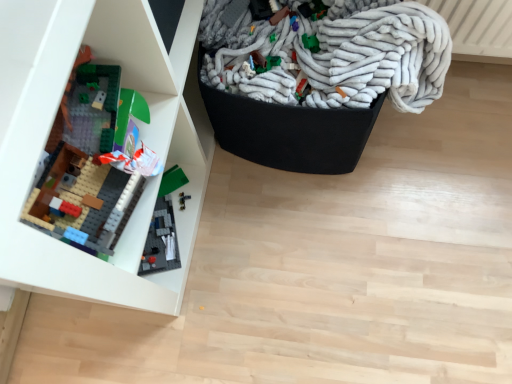
This screenshot has width=512, height=384. What do you see at coordinates (138, 125) in the screenshot? I see `matte plastic lego set at left` at bounding box center [138, 125].

This screenshot has width=512, height=384. Find the location of `matte plastic lego set at left`. matte plastic lego set at left is located at coordinates (138, 125).

What are the coordinates of `white fuzzy blanket at upper right` in the screenshot? It's located at (334, 57).

The width and height of the screenshot is (512, 384). What do you see at coordinates (334, 57) in the screenshot? I see `white fuzzy blanket at upper right` at bounding box center [334, 57].

The image size is (512, 384). I want to click on matte plastic lego set at left, so click(138, 125).

Based on the photo, which object is positioned more to the left, white fuzzy blanket at upper right or matte plastic lego set at left?

matte plastic lego set at left.

Is white fuzzy blanket at upper right closer to camera compared to matte plastic lego set at left?

No.

Is point (212, 65) closer or farther from the camera than point (195, 221)?

Point (212, 65) is positioned closer to the camera compared to point (195, 221).

From the image's perspective, is white fuzzy blanket at upper right beneath matte plastic lego set at left?

No, from the image's perspective, white fuzzy blanket at upper right is not below matte plastic lego set at left.

From a real-world perspective, between white fuzzy blanket at upper right and matte plastic lego set at left, who is vertically lower?

white fuzzy blanket at upper right, from a real-world perspective.

Considering the sizes of objects white fuzzy blanket at upper right and matte plastic lego set at left in the image provided, who is wider, white fuzzy blanket at upper right or matte plastic lego set at left?

white fuzzy blanket at upper right is wider.

Does white fuzzy blanket at upper right have a lesser height compared to matte plastic lego set at left?

Correct, white fuzzy blanket at upper right is not as tall as matte plastic lego set at left.

Looking at this image, does white fuzzy blanket at upper right have a larger size compared to matte plastic lego set at left?

Actually, white fuzzy blanket at upper right might be smaller than matte plastic lego set at left.

Can we say white fuzzy blanket at upper right lies outside matte plastic lego set at left?

Indeed, white fuzzy blanket at upper right is completely outside matte plastic lego set at left.

Is white fuzzy blanket at upper right in contact with matte plastic lego set at left?

white fuzzy blanket at upper right and matte plastic lego set at left are not in contact.

Is white fuzzy blanket at upper right looking in the opposite direction of matte plastic lego set at left?

Yes, white fuzzy blanket at upper right's orientation is away from matte plastic lego set at left.

What's the angular difference between white fuzzy blanket at upper right and matte plastic lego set at left's facing directions?

white fuzzy blanket at upper right and matte plastic lego set at left are facing 1.88e-05 degrees away from each other.

Locate an element on the screen. The width and height of the screenshot is (512, 384). wrap behind the matte plastic lego set at left is located at coordinates (334, 57).

Considering the positions of objects matte plastic lego set at left and white fuzzy blanket at upper right in the image provided, who is more to the left, matte plastic lego set at left or white fuzzy blanket at upper right?

From the viewer's perspective, matte plastic lego set at left appears more on the left side.

Does matte plastic lego set at left come behind white fuzzy blanket at upper right?

No.

Is point (20, 132) positioned before point (264, 32)?

Yes, it is.

From the image's perspective, is matte plastic lego set at left above or below white fuzzy blanket at upper right?

matte plastic lego set at left is situated lower than white fuzzy blanket at upper right in the image.

From a real-world perspective, is matte plastic lego set at left under white fuzzy blanket at upper right?

No, from a real-world perspective, matte plastic lego set at left is not under white fuzzy blanket at upper right.

Considering the sizes of objects matte plastic lego set at left and white fuzzy blanket at upper right in the image provided, who is thinner, matte plastic lego set at left or white fuzzy blanket at upper right?

matte plastic lego set at left is thinner.

Who is taller, matte plastic lego set at left or white fuzzy blanket at upper right?

matte plastic lego set at left.

Between matte plastic lego set at left and white fuzzy blanket at upper right, which one has larger size?

With larger size is matte plastic lego set at left.

Looking at this image, is matte plastic lego set at left completely or partially outside of white fuzzy blanket at upper right?

Yes, matte plastic lego set at left is outside of white fuzzy blanket at upper right.

Based on the photo, is matte plastic lego set at left next to white fuzzy blanket at upper right and touching it?

No.

Is matte plastic lego set at left oriented away from white fuzzy blanket at upper right?

No, matte plastic lego set at left is not facing away from white fuzzy blanket at upper right.

In the scene shown: How far apart are matte plastic lego set at left and white fuzzy blanket at upper right?

matte plastic lego set at left is 12.43 inches from white fuzzy blanket at upper right.

You are a GUI agent. You are given a task and a screenshot of the screen. Output one action in this format:
    pyautogui.click(x=<x>, y=<y>)
    Task: Click on the wrap that appears below the matte plastic lego set at left (from a real-world perspective)
    Image resolution: width=512 pixels, height=384 pixels.
    Given the screenshot: What is the action you would take?
    pyautogui.click(x=334, y=57)

The image size is (512, 384). Identify the location of wrap that is on the right side of matte plastic lego set at left. (334, 57).

Image resolution: width=512 pixels, height=384 pixels. I want to click on shelf located on the left of white fuzzy blanket at upper right, so click(x=138, y=125).